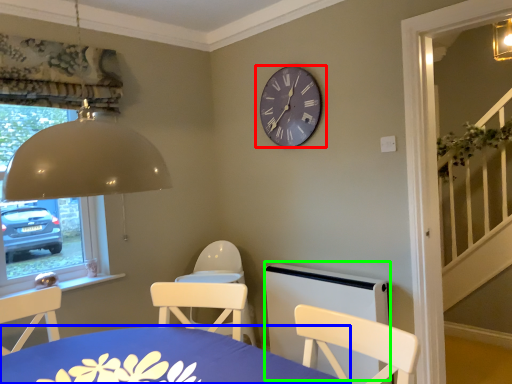
Question: Which object is positioned closest to wall clock (highlighted by a red box)? Select from table (highlighted by a blue box) and bed frame (highlighted by a green box).

Choices:
 (A) table
 (B) bed frame

Answer: (B)